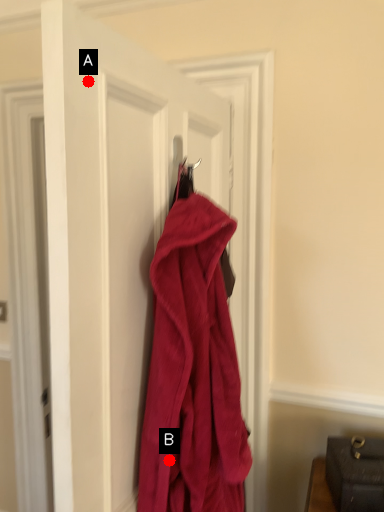
Question: Two points are circled on the image, labeled by A and B beside each circle. Which point is closer to the camera?

Choices:
 (A) A is closer
 (B) B is closer

Answer: (A)